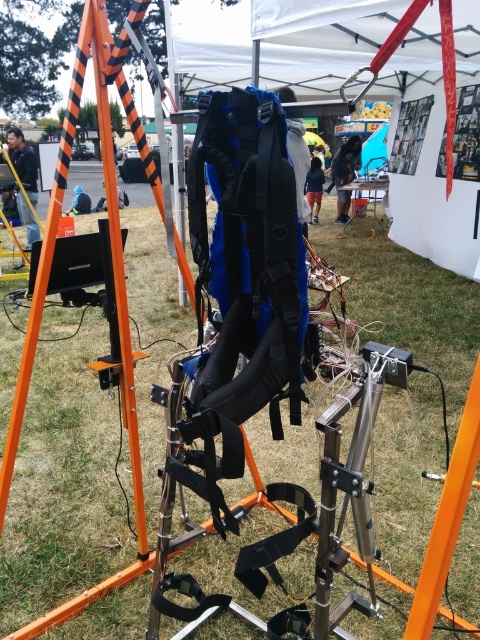
Question: Can you confirm if orange metallic ladder at center is positioned above dark blue fabric jacket at center?

Choices:
 (A) yes
 (B) no

Answer: (B)

Question: Which object is the closest to the orange metallic ladder at center?

Choices:
 (A) green grass at center
 (B) dark blue fabric jacket at center
 (C) blue fabric jacket at center
 (D) matte black jacket at left

Answer: (A)

Question: Which point appears closest to the camera in this image?

Choices:
 (A) (346, 195)
 (B) (309, 195)
 (C) (55, 531)

Answer: (C)

Question: Can you confirm if matte black jacket at left is wider than blue fabric jacket at center?

Choices:
 (A) no
 (B) yes

Answer: (B)

Question: Which object is the farthest from the blue fabric jacket at center?

Choices:
 (A) dark blue fabric jacket at center
 (B) matte black jacket at left

Answer: (B)

Question: Is green grass at center positioned behind dark blue fabric jacket at center?

Choices:
 (A) yes
 (B) no

Answer: (B)